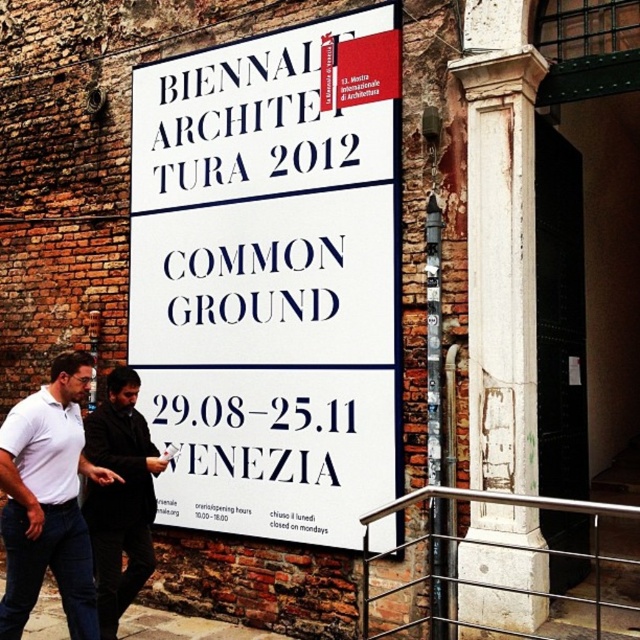
Is white stone column at center bigger than white cotton shirt at lower left?

Yes, white stone column at center is bigger than white cotton shirt at lower left.

Is point (468, 456) positioned behind point (48, 481)?

Yes, point (468, 456) is farther from viewer.

I want to click on white stone column at center, so click(500, 243).

Does point (330, 429) come in front of point (109, 452)?

No, (330, 429) is further to viewer.

Who is more forward, [214,454] or [120,570]?

Point [120,570]

Who is more distant from viewer, (332,468) or (141,547)?

Point (141,547)

At what (x,y) coordinates should I click in order to perform the action: click on white paper at center. Please return your answer as a coordinate pair (x, y). Looking at the image, I should click on (257, 435).

Looking at this image, is white stone column at center further to camera compared to white paper at center?

No, it is in front of white paper at center.

Locate an element on the screen. This screenshot has width=640, height=640. white stone column at center is located at coordinates (500, 243).

Is point (477, 260) positioned after point (241, 416)?

No.

The height and width of the screenshot is (640, 640). I want to click on white stone column at center, so click(500, 243).